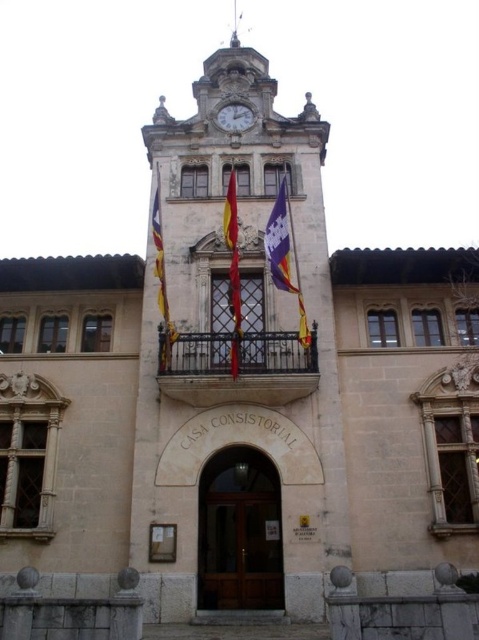
Describe the element at coordinates (239, 368) in the screenshot. The image size is (479, 640). I see `black wrought iron balcony at center` at that location.

Which is behind, point (185, 376) or point (305, 337)?

Point (305, 337)

Image resolution: width=479 pixels, height=640 pixels. I want to click on black wrought iron balcony at center, so click(x=239, y=368).

Based on the photo, does brown wooden door at center appear on the right side of red fabric flag at center?

Indeed, brown wooden door at center is positioned on the right side of red fabric flag at center.

Who is positioned more to the right, brown wooden door at center or red fabric flag at center?

brown wooden door at center is more to the right.

Between point (264, 570) and point (230, 253), which one is positioned in front?

Positioned in front is point (264, 570).

Where is `brown wooden door at center`? The width and height of the screenshot is (479, 640). brown wooden door at center is located at coordinates (239, 532).

Locate an element on the screen. stone clock tower at center is located at coordinates (239, 368).